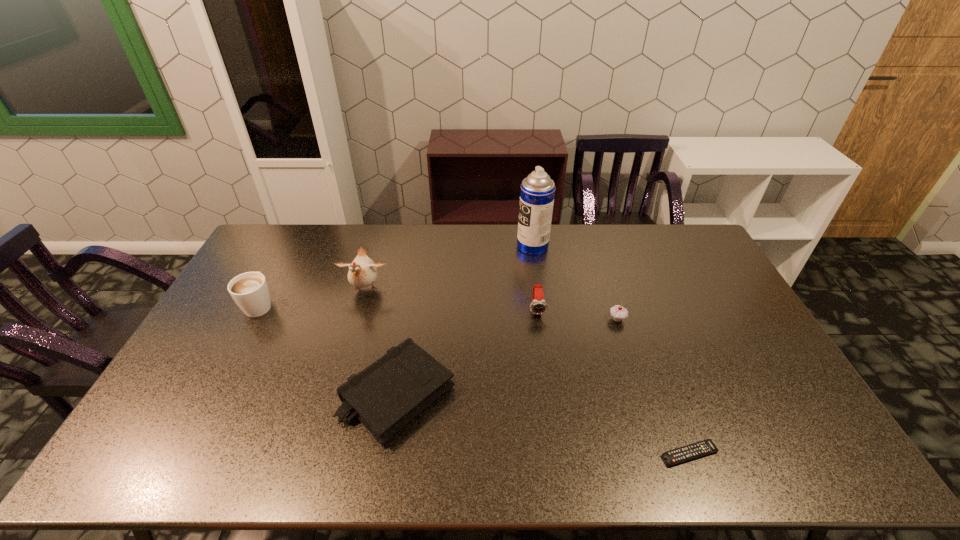
Where is `free point between the third tallest object and the sixth shortest object`? This screenshot has height=540, width=960. free point between the third tallest object and the sixth shortest object is located at coordinates (313, 297).

At what (x,y) coordinates should I click in order to perform the action: click on object that is the sixth closest to the aerosol can. Please return your answer as a coordinate pair (x, y). The width and height of the screenshot is (960, 540). Looking at the image, I should click on (250, 291).

Find the location of a particular element. Image resolution: width=960 pixels, height=540 pixels. object that stands as the second closest to the bird is located at coordinates (385, 396).

Where is `free location that satisfies the following two spatial constraints: 1. on the face of the watch; 2. on the left side of the remote control`? The width and height of the screenshot is (960, 540). free location that satisfies the following two spatial constraints: 1. on the face of the watch; 2. on the left side of the remote control is located at coordinates (557, 454).

Identify the location of vacant space that satisfies the following two spatial constraints: 1. on the front side of the remote control; 2. on the left side of the cupcake. This screenshot has height=540, width=960. [660, 454].